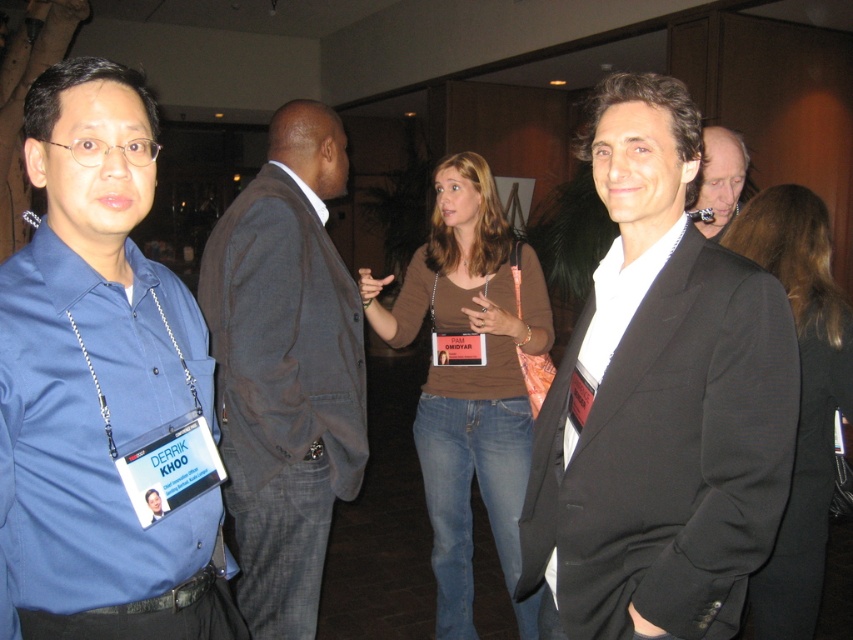
Question: Is dark brown suit at center wider than smooth gray suit at right?

Choices:
 (A) no
 (B) yes

Answer: (B)

Question: Does brown cotton shirt at center have a smaller size compared to smooth gray suit at right?

Choices:
 (A) no
 (B) yes

Answer: (A)

Question: Based on their relative distances, which object is nearer to the smooth gray suit at right?

Choices:
 (A) brown leather jacket at center
 (B) matte blue shirt at left
 (C) brown cotton shirt at center
 (D) black satin suit at right

Answer: (A)

Question: Is brown cotton shirt at center bigger than brown leather jacket at center?

Choices:
 (A) no
 (B) yes

Answer: (B)

Question: Which point appears closest to the camera in this image?

Choices:
 (A) (813, 461)
 (B) (494, 244)

Answer: (A)

Question: Which object is closer to the camera taking this photo?

Choices:
 (A) matte blue shirt at left
 (B) smooth gray suit at right
 (C) brown leather jacket at center

Answer: (A)